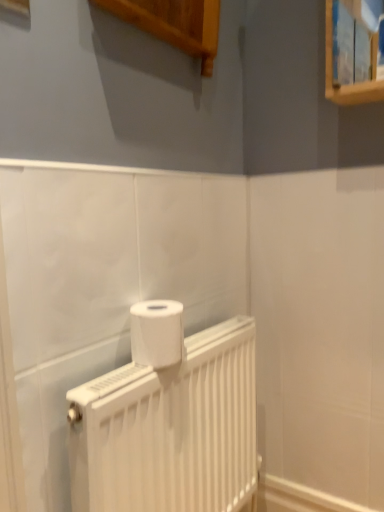
Question: Is white matte radiator at center inside or outside of white matte toilet paper at center?

Choices:
 (A) inside
 (B) outside

Answer: (B)

Question: Is white matte radiator at center wider or thinner than white matte toilet paper at center?

Choices:
 (A) thin
 (B) wide

Answer: (A)

Question: Based on their positions, is white matte radiator at center located to the left or right of white matte toilet paper at center?

Choices:
 (A) left
 (B) right

Answer: (B)

Question: Is white matte toilet paper at center in front of or behind white matte radiator at center in the image?

Choices:
 (A) behind
 (B) front

Answer: (A)

Question: Is point (132, 316) closer or farther from the camera than point (87, 404)?

Choices:
 (A) farther
 (B) closer

Answer: (A)

Question: From the image's perspective, is white matte toilet paper at center positioned above or below white matte radiator at center?

Choices:
 (A) above
 (B) below

Answer: (A)

Question: From a real-world perspective, is white matte toilet paper at center positioned above or below white matte radiator at center?

Choices:
 (A) above
 (B) below

Answer: (A)